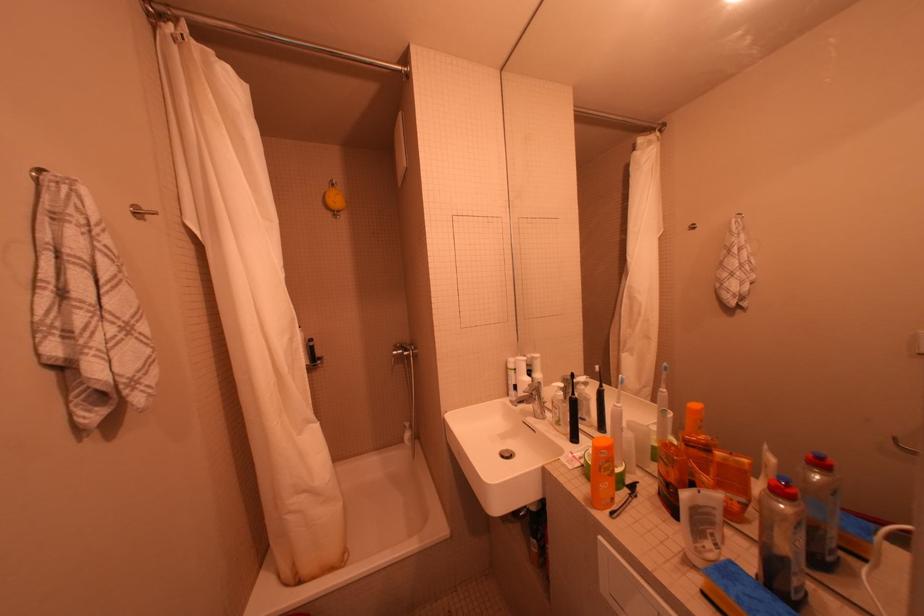
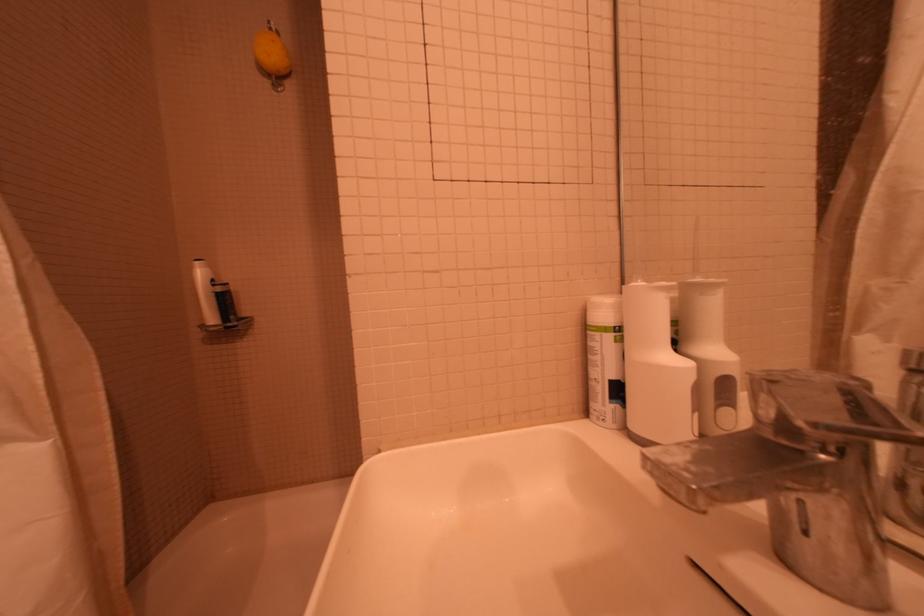
Where in the second image is the point corresponding to (x=524, y=363) from the first image?

(627, 309)